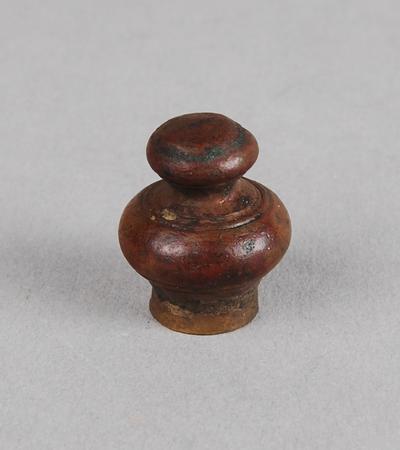
The height and width of the screenshot is (450, 400). In order to click on handle in this screenshot , I will do [209, 238].